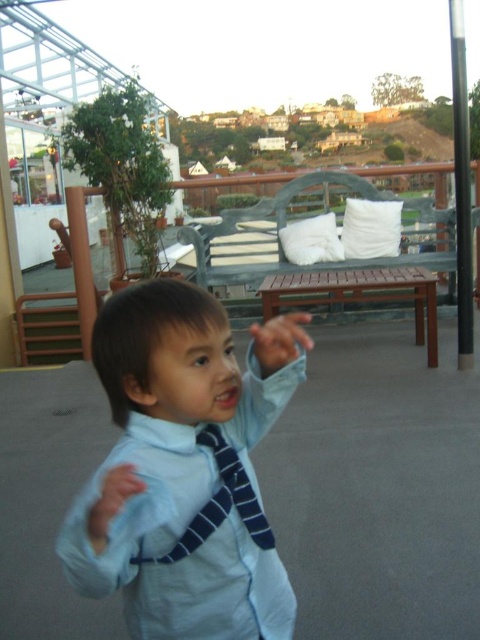
Does blue striped tie at center have a lesser width compared to smooth skin hand at center?

Correct, blue striped tie at center's width is less than smooth skin hand at center's.

In the scene shown: Does blue striped tie at center have a larger size compared to smooth skin hand at center?

Correct, blue striped tie at center is larger in size than smooth skin hand at center.

I want to click on blue striped tie at center, so click(x=219, y=502).

This screenshot has height=640, width=480. What are the coordinates of `blue striped tie at center` in the screenshot? It's located at (219, 502).

Which of these two, blue striped tie at center or matte blue tie at center, stands shorter?

matte blue tie at center is shorter.

Is point (227, 464) closer to camera compared to point (134, 490)?

No, (227, 464) is behind (134, 490).

Image resolution: width=480 pixels, height=640 pixels. What do you see at coordinates (219, 502) in the screenshot?
I see `blue striped tie at center` at bounding box center [219, 502].

You are a GUI agent. You are given a task and a screenshot of the screen. Output one action in this format:
    pyautogui.click(x=<x>, y=<y>)
    Task: Click on the blue striped tie at center
    The height and width of the screenshot is (640, 480).
    Given the screenshot: What is the action you would take?
    pyautogui.click(x=219, y=502)

Between light blue shirt at center and matte blue tie at center, which one has less height?

matte blue tie at center is shorter.

Does light blue shirt at center appear on the left side of matte blue tie at center?

In fact, light blue shirt at center is to the right of matte blue tie at center.

Where is `light blue shirt at center`? light blue shirt at center is located at coordinates (183, 474).